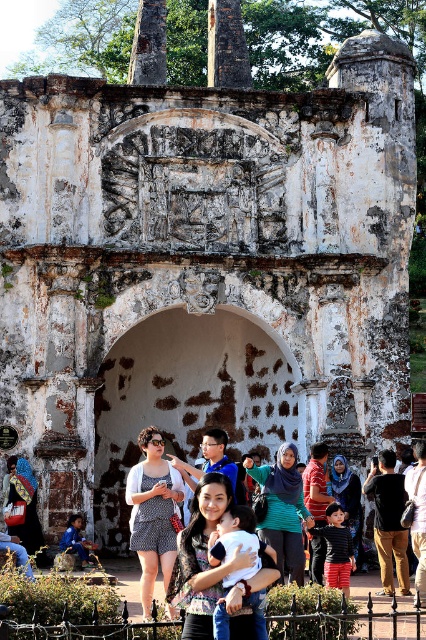
Question: Which object is positioned closest to the matte black bag at center?

Choices:
 (A) blue denim jeans at center
 (B) printed cotton dress at center
 (C) soft blue fabric at center

Answer: (B)

Question: Which object is the farthest from the striped sweater at center?

Choices:
 (A) green knitted sweater at center
 (B) blue denim jeans at center
 (C) matte black dress at center
 (D) dark brown leather jacket at center

Answer: (C)

Question: Is black cotton shirt at center thinner than striped shirt at center?

Choices:
 (A) yes
 (B) no

Answer: (B)

Question: Can you confirm if green knitted sweater at center is thinner than striped sweater at center?

Choices:
 (A) no
 (B) yes

Answer: (A)

Question: Which object is positioned closest to the black cotton shirt at center?

Choices:
 (A) blue denim jeans at center
 (B) dark brown leather jacket at center
 (C) matte black dress at center
 (D) striped shirt at center

Answer: (B)

Question: Can you confirm if striped sweater at center is positioned to the left of matte black bag at center?

Choices:
 (A) yes
 (B) no

Answer: (B)